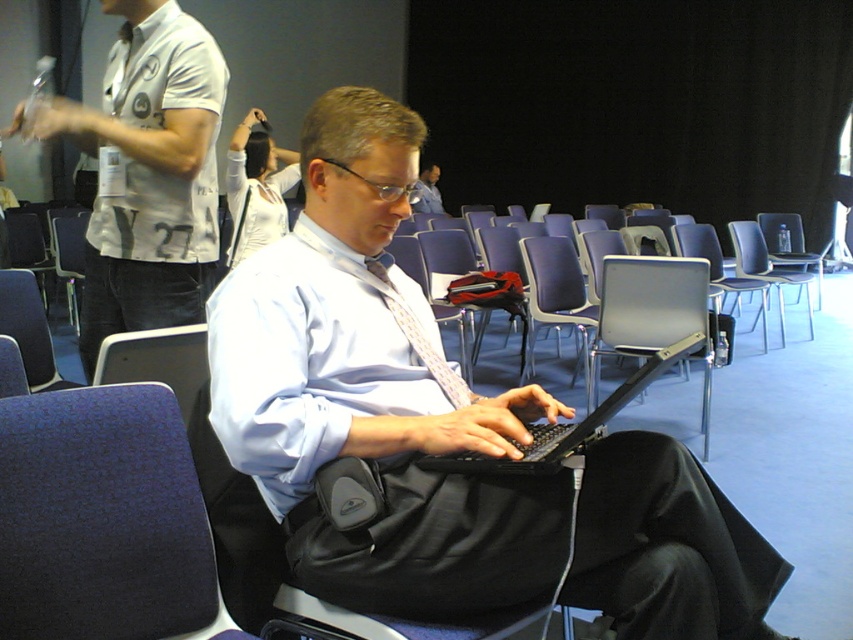
Is point (730, 230) less distant than point (421, 168)?

Yes, it is.

Who is positioned more to the left, blue plastic chair at center or matte white shirt at center?

From the viewer's perspective, matte white shirt at center appears more on the left side.

Does point (740, 262) come farther from viewer compared to point (424, 188)?

No, it is not.

I want to click on blue plastic chair at center, so click(766, 268).

Which is behind, point (62, 544) or point (757, 237)?

The point (757, 237) is behind.

How distant is dark blue fabric chair at lower left from blue plastic chair at center?

The distance of dark blue fabric chair at lower left from blue plastic chair at center is 4.76 meters.

At what (x,y) coordinates should I click in order to perform the action: click on dark blue fabric chair at lower left. Please return your answer as a coordinate pair (x, y). Image resolution: width=853 pixels, height=640 pixels. Looking at the image, I should click on (102, 518).

Which is behind, point (80, 124) or point (566, 442)?

The point (80, 124) is behind.

Is white shirt at center in front of black plastic laptop at center?

No, white shirt at center is further to the viewer.

Which is behind, point (215, 196) or point (566, 451)?

Point (215, 196)

This screenshot has height=640, width=853. In order to click on white shirt at center in this screenshot , I will do `click(146, 172)`.